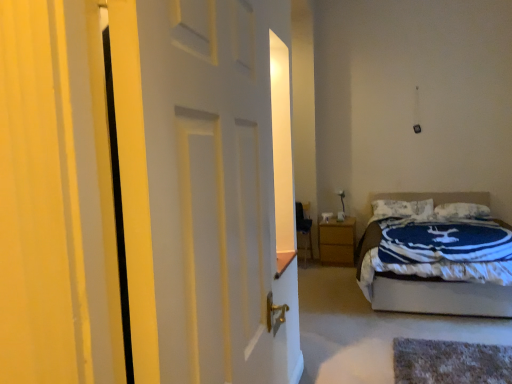
Question: Is the depth of white matte door at center greater than that of wooden nightstand at lower right?

Choices:
 (A) no
 (B) yes

Answer: (A)

Question: Is white matte door at center positioned in front of wooden nightstand at lower right?

Choices:
 (A) no
 (B) yes

Answer: (B)

Question: From the image's perspective, does white matte door at center appear higher than wooden nightstand at lower right?

Choices:
 (A) yes
 (B) no

Answer: (A)

Question: Can you confirm if white matte door at center is wider than wooden nightstand at lower right?

Choices:
 (A) yes
 (B) no

Answer: (B)

Question: Is white matte door at center completely or partially outside of wooden nightstand at lower right?

Choices:
 (A) yes
 (B) no

Answer: (A)

Question: From a real-world perspective, is wooden nightstand at lower right above or below blue and white quilted bed at right?

Choices:
 (A) above
 (B) below

Answer: (B)

Question: From the image's perspective, is wooden nightstand at lower right positioned above or below blue and white quilted bed at right?

Choices:
 (A) above
 (B) below

Answer: (B)

Question: Looking at the image, does wooden nightstand at lower right seem bigger or smaller compared to blue and white quilted bed at right?

Choices:
 (A) small
 (B) big

Answer: (A)

Question: Considering the positions of wooden nightstand at lower right and blue and white quilted bed at right in the image, is wooden nightstand at lower right wider or thinner than blue and white quilted bed at right?

Choices:
 (A) thin
 (B) wide

Answer: (A)

Question: Relative to white textured pillow at upper center, which is counted as the first pillow, starting from the left, is blue and white quilted bed at right in front or behind?

Choices:
 (A) front
 (B) behind

Answer: (A)

Question: Is blue and white quilted bed at right situated inside white textured pillow at upper center, which is counted as the first pillow, starting from the left, or outside?

Choices:
 (A) inside
 (B) outside

Answer: (B)

Question: From the image's perspective, is blue and white quilted bed at right located above or below white textured pillow at upper center, which is counted as the first pillow, starting from the left?

Choices:
 (A) below
 (B) above

Answer: (A)

Question: Considering the positions of point (451, 201) and point (433, 206), is point (451, 201) closer or farther from the camera than point (433, 206)?

Choices:
 (A) farther
 (B) closer

Answer: (A)

Question: Is wooden nightstand at lower right inside or outside of white soft pillow at upper center, the second pillow in the left-to-right sequence?

Choices:
 (A) outside
 (B) inside

Answer: (A)

Question: From a real-world perspective, is wooden nightstand at lower right physically located above or below white soft pillow at upper center, the second pillow in the left-to-right sequence?

Choices:
 (A) below
 (B) above

Answer: (A)